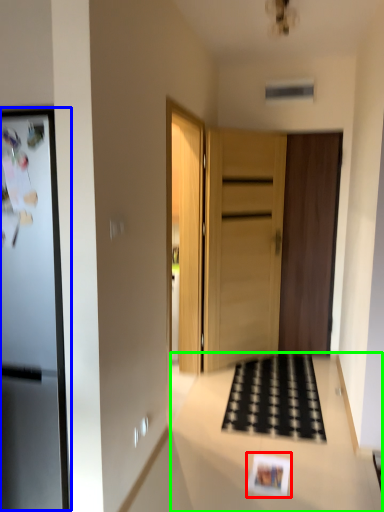
Question: Which object is the farthest from postcard (highlighted by a red box)? Choose among these: fridge (highlighted by a blue box) or counter top (highlighted by a green box).

Choices:
 (A) fridge
 (B) counter top

Answer: (A)